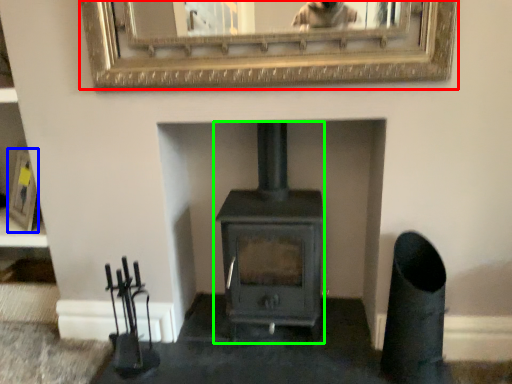
Question: Based on their relative distances, which object is farther from picture frame (highlighted by a red box)? Choose from picture frame (highlighted by a blue box) and wood burning stove (highlighted by a green box).

Choices:
 (A) picture frame
 (B) wood burning stove

Answer: (A)